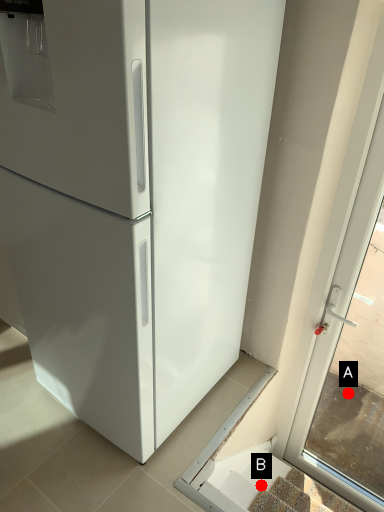
Question: Two points are circled on the image, labeled by A and B beside each circle. Among these points, which one is nearest to the camera?

Choices:
 (A) A is closer
 (B) B is closer

Answer: (B)